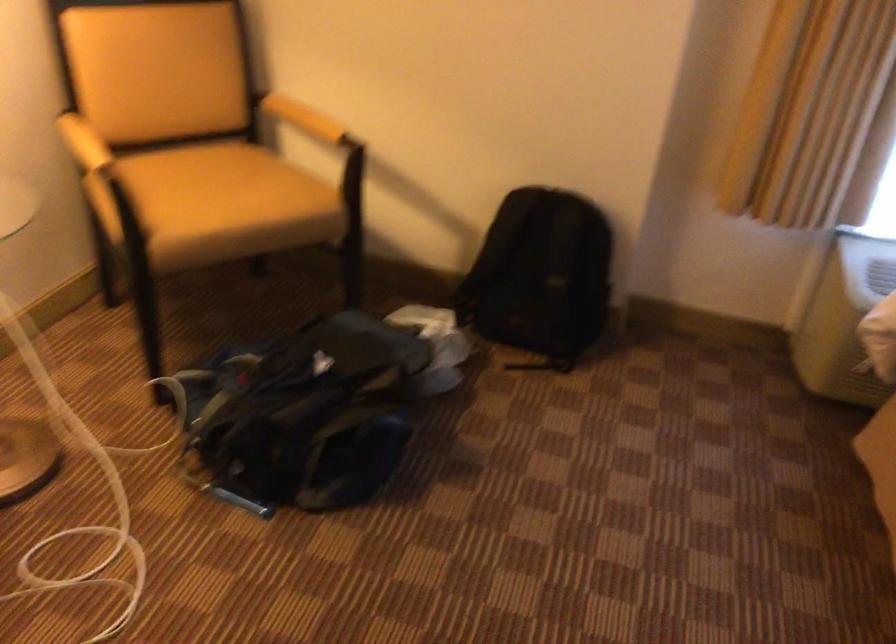
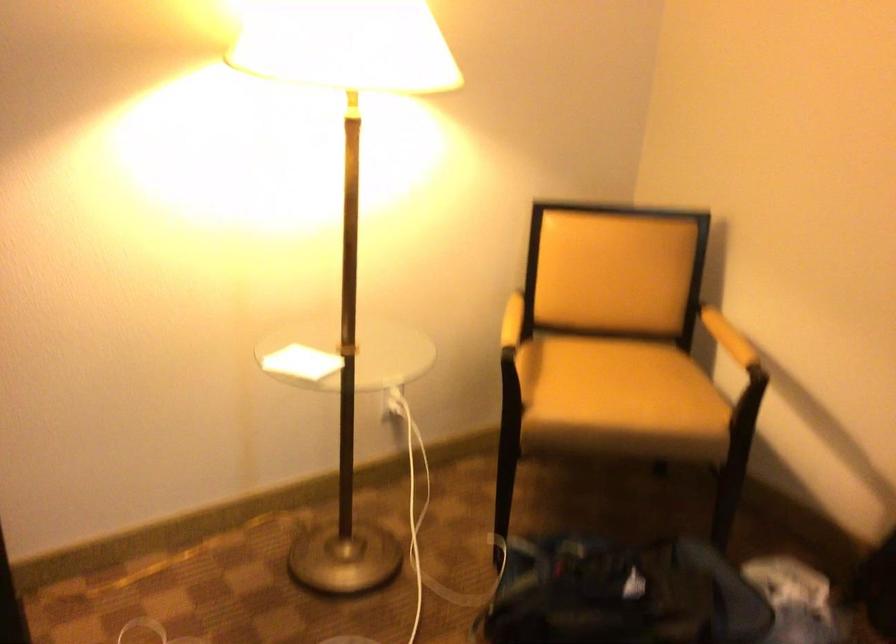
The point at (104,140) is marked in the first image. Where is the corresponding point in the second image?

(512, 321)